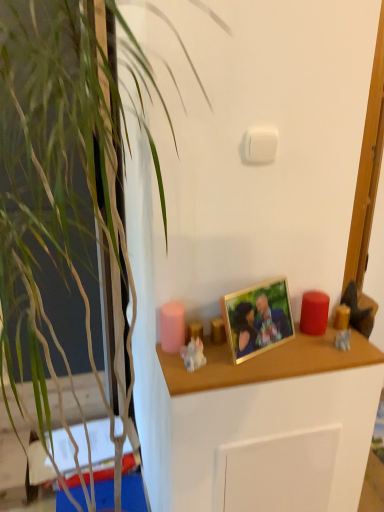
The image size is (384, 512). In order to click on vacant space that is to the left of translucent amber glass candle at right, positioned as the first candle in right-to-left order in this screenshot , I will do `click(291, 344)`.